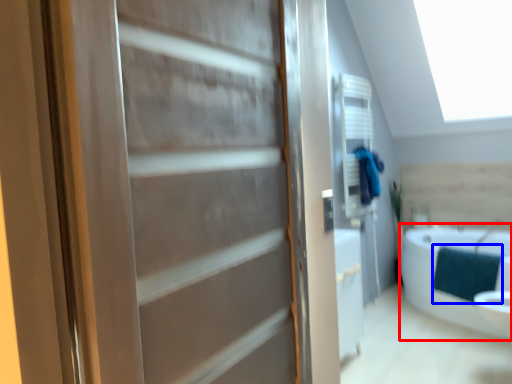
Question: Which object is further to the camera taking this photo, bathtub (highlighted by a red box) or blanket (highlighted by a blue box)?

Choices:
 (A) bathtub
 (B) blanket

Answer: (B)